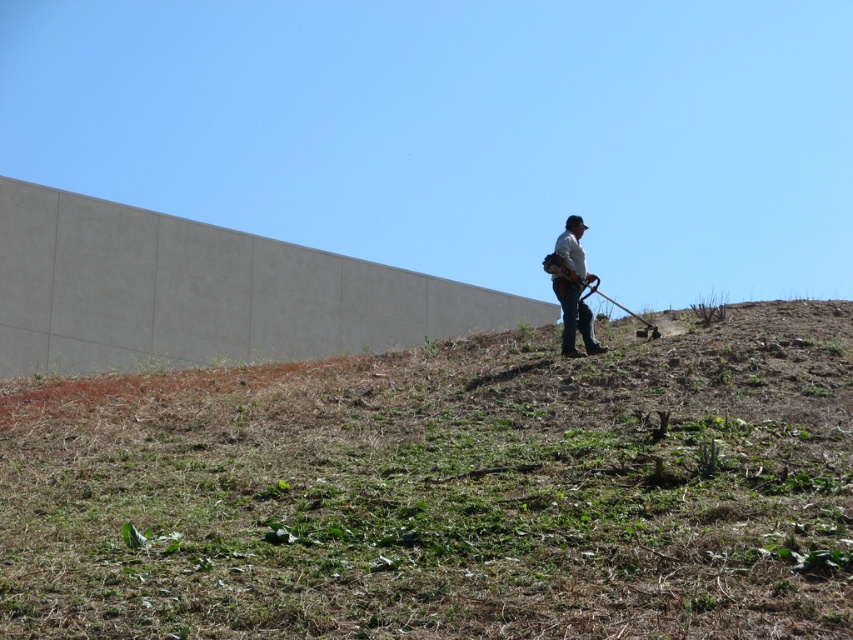
You are standing at point (445, 492) in the image. What is the closest object to you?

The closest object to you at point (445, 492) is the green grassy area at upper center.

Consider the image. You are a landscape architect observing the outdoor scene. You notice the green grassy at upper center and the white fabric shirt at center. Which object is positioned lower in the image?

The green grassy at upper center is below the white fabric shirt at center, so the green grassy at upper center is positioned lower in the image.